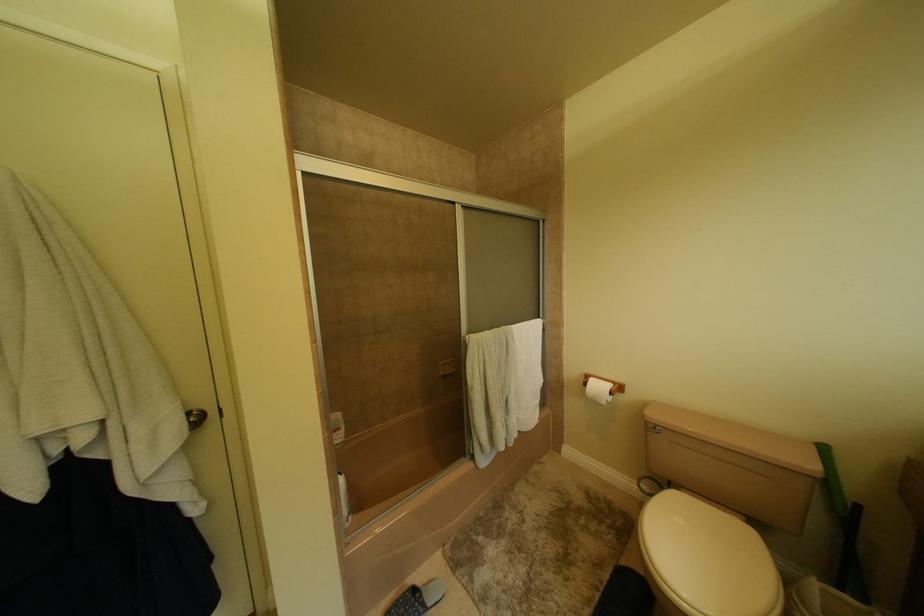
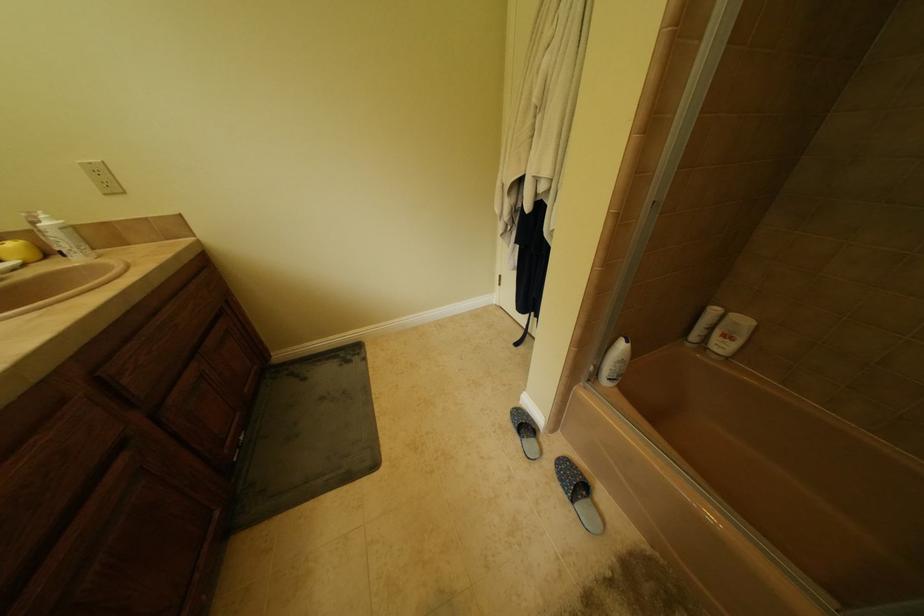
How did the camera likely rotate?

The rotation direction of the camera is left-down.